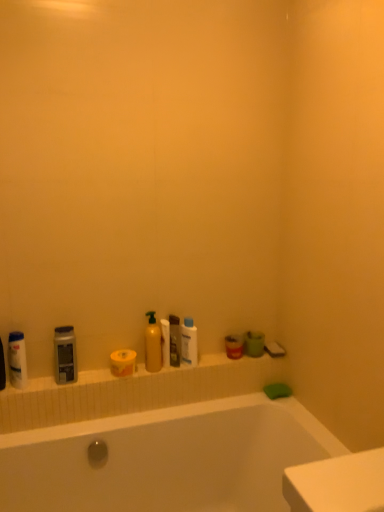
Find the location of a particular element. The height and width of the screenshot is (512, 384). vacant space to the left of matte gray bottle at left, which is counted as the first cleaning product, starting from the left is located at coordinates (37, 386).